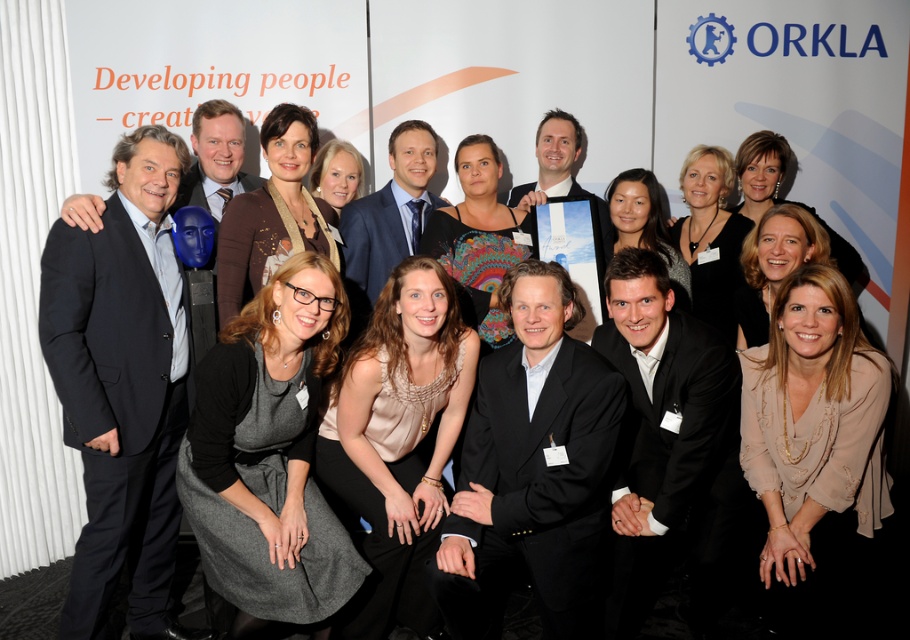
Question: Among these points, which one is nearest to the camera?

Choices:
 (A) (809, 324)
 (B) (248, 577)
 (C) (392, 317)

Answer: (A)

Question: Is gray wool dress at center bigger than beige satin blouse at lower right?

Choices:
 (A) yes
 (B) no

Answer: (B)

Question: Does beige satin blouse at lower right appear under matte beige blouse at center?

Choices:
 (A) yes
 (B) no

Answer: (A)

Question: Which point is farther to the camera?

Choices:
 (A) (251, 362)
 (B) (781, 508)

Answer: (B)

Question: Does black suit at center appear on the left side of beige satin blouse at lower right?

Choices:
 (A) yes
 (B) no

Answer: (A)

Question: Considering the real-world distances, which object is farthest from the gray wool dress at center?

Choices:
 (A) matte beige blouse at center
 (B) dark blue suit at left
 (C) matte brown dress at center

Answer: (C)